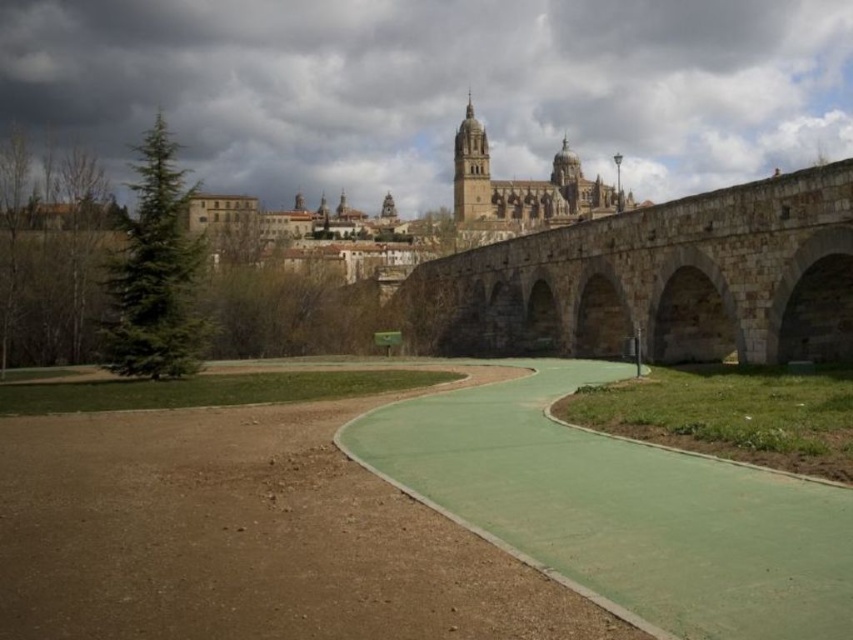
Question: Does matte stone bridge at center appear on the right side of stone arch bridge at center?

Choices:
 (A) yes
 (B) no

Answer: (B)

Question: Which is farther from the green concrete path at center?

Choices:
 (A) matte stone bridge at center
 (B) stone arch bridge at center

Answer: (A)

Question: Can you confirm if matte stone bridge at center is positioned above stone arch bridge at center?

Choices:
 (A) no
 (B) yes

Answer: (B)

Question: Which point appears farthest from the camera in this image?

Choices:
 (A) (815, 509)
 (B) (477, 56)

Answer: (B)

Question: Which point is farther to the camera?

Choices:
 (A) matte stone bridge at center
 (B) green concrete path at center

Answer: (A)

Question: In this image, where is green concrete path at center located relative to stone arch bridge at center?

Choices:
 (A) left
 (B) right

Answer: (A)